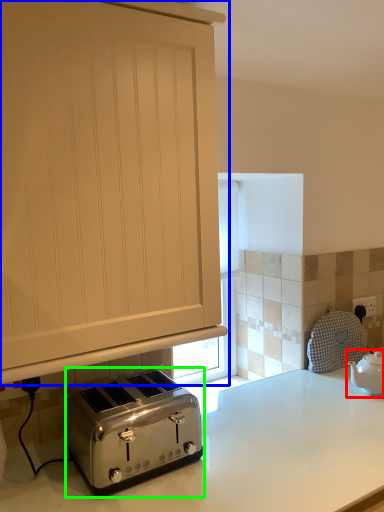
Question: Which object is positioned farthest from tea pot (highlighted by a red box)? Select from cabinetry (highlighted by a blue box) and toaster (highlighted by a green box).

Choices:
 (A) cabinetry
 (B) toaster

Answer: (A)